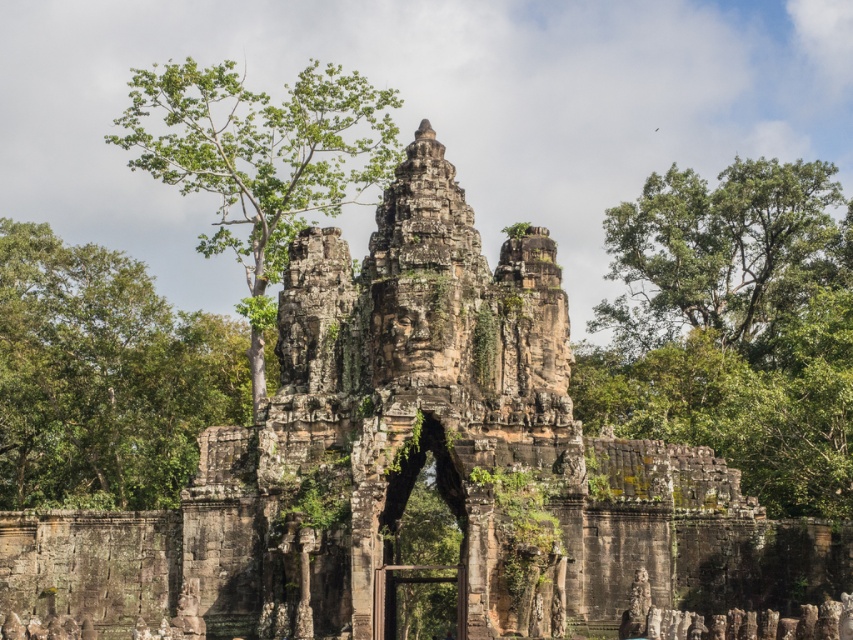
You are an archaeologist examining the ancient stone structure. You notice two green leafy trees flanking the central stone face. Which tree is closer to you, the green leafy tree at right or the green leafy tree at left?

The green leafy tree at right is closer to you because it is in front of the green leafy tree at left.

You are standing in front of the ancient stone structure and notice two points marked on the image. The first point is at coordinates point (119,392) and the second is at point (254,205). Which of these two points is nearer to you?

Point (119,392) is closer to the viewer than point (254,205).